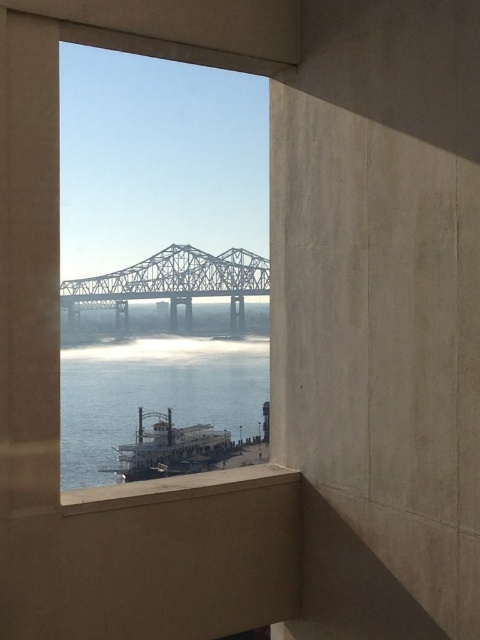
Question: Which object appears closest to the camera in this image?

Choices:
 (A) clear glass window at center
 (B) metallic gray bridge at center
 (C) clear water at lower center

Answer: (A)

Question: Considering the real-world distances, which object is closest to the clear glass window at center?

Choices:
 (A) metallic gray bridge at center
 (B) white wooden boat at lower center
 (C) clear water at lower center

Answer: (A)

Question: Is the position of metallic gray bridge at center more distant than that of white wooden boat at lower center?

Choices:
 (A) yes
 (B) no

Answer: (B)

Question: Is clear glass window at center closer to the viewer compared to metallic gray bridge at center?

Choices:
 (A) no
 (B) yes

Answer: (B)

Question: Among these objects, which one is farthest from the camera?

Choices:
 (A) white wooden boat at lower center
 (B) clear glass window at center
 (C) metallic gray bridge at center
 (D) clear water at lower center

Answer: (A)

Question: Does metallic gray bridge at center come in front of white wooden boat at lower center?

Choices:
 (A) no
 (B) yes

Answer: (B)